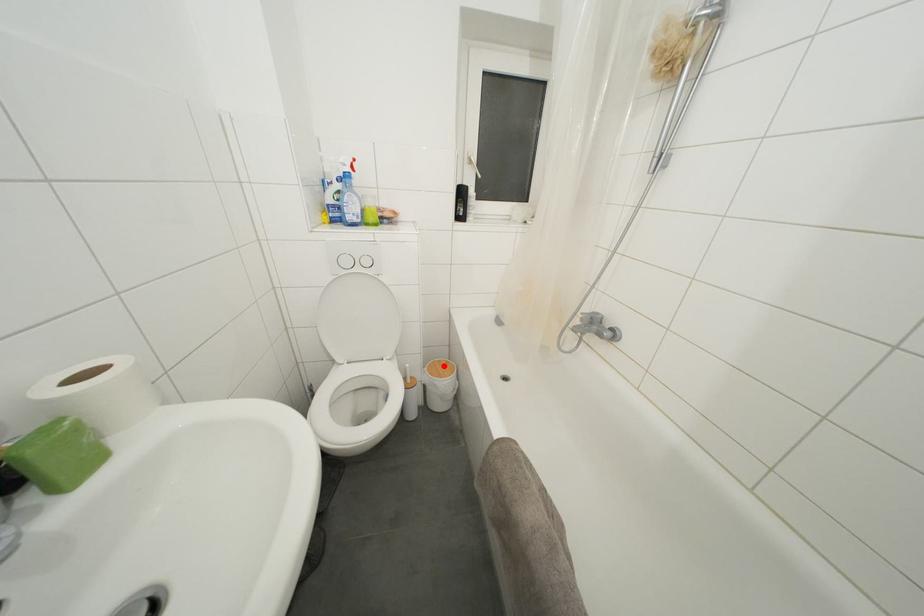
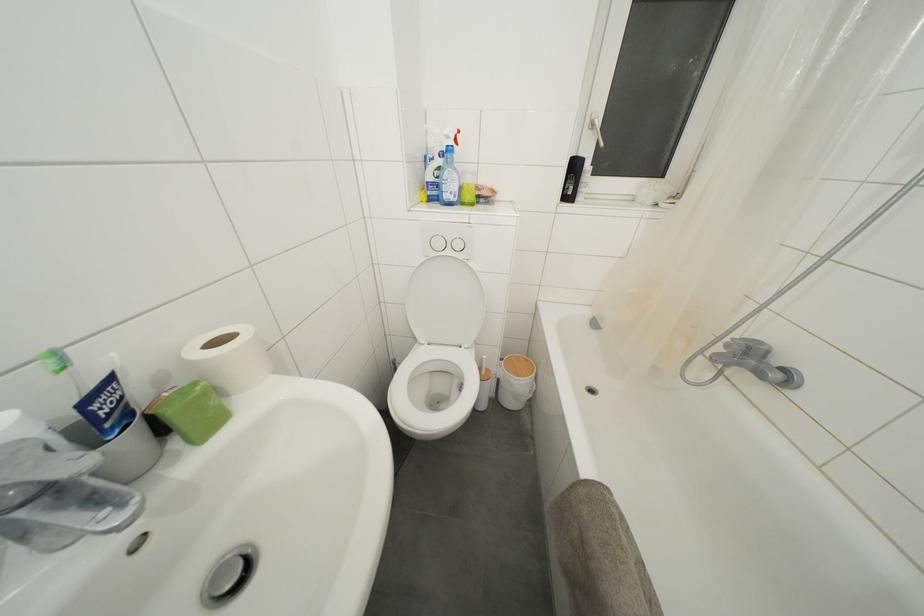
Question: I am providing you with two images of the same scene from different viewpoints. A red point is shown in image1. For the corresponding object point in image2, is it positioned nearer or farther from the camera?

Choices:
 (A) Nearer
 (B) Farther

Answer: (B)